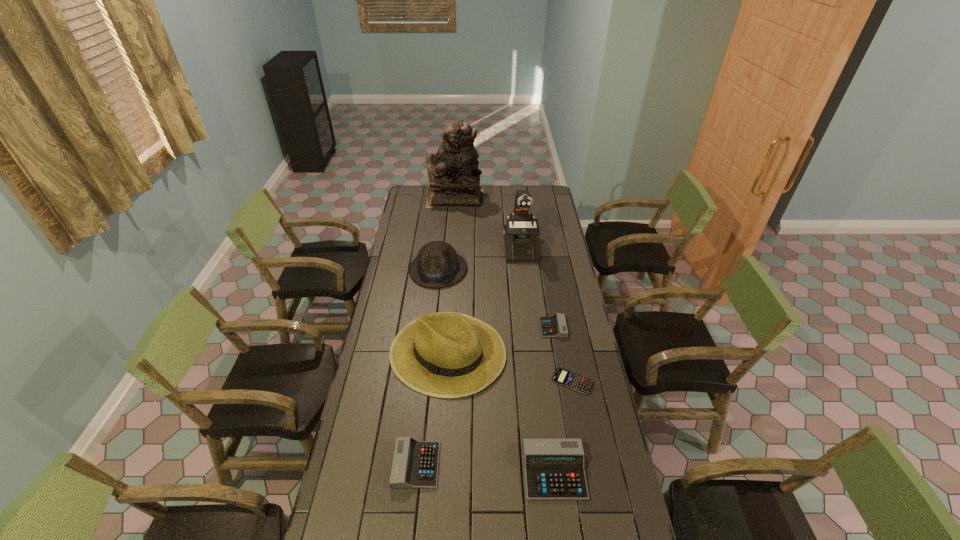
Where is `sculpture`? sculpture is located at coordinates (453, 181).

Find the location of a particular element. the tallest object is located at coordinates (453, 181).

Where is `the seventh shortest object`? This screenshot has width=960, height=540. the seventh shortest object is located at coordinates (521, 245).

The height and width of the screenshot is (540, 960). I want to click on black sunhat, so click(447, 355).

Identify the location of bowler hat. (437, 264).

Image resolution: width=960 pixels, height=540 pixels. Find the location of `the fifth tallest object`. the fifth tallest object is located at coordinates (554, 469).

Find the location of a particular element. The image size is (960, 540). the tallest calculator is located at coordinates (554, 469).

You are a GUI agent. You are given a task and a screenshot of the screen. Output one action in this format:
    pyautogui.click(x=<x>, y=<y>)
    Task: Click on the leftmost gray calculator
    This screenshot has height=540, width=960.
    Given the screenshot: What is the action you would take?
    (x=415, y=463)

Find the location of a particular element. The height and width of the screenshot is (540, 960). the third shortest calculator is located at coordinates (415, 463).

You are a GUI agent. You are given a task and a screenshot of the screen. Output one action in this format:
    pyautogui.click(x=<x>, y=<y>)
    Task: Click on the seventh tallest object
    
    Given the screenshot: What is the action you would take?
    pyautogui.click(x=555, y=326)